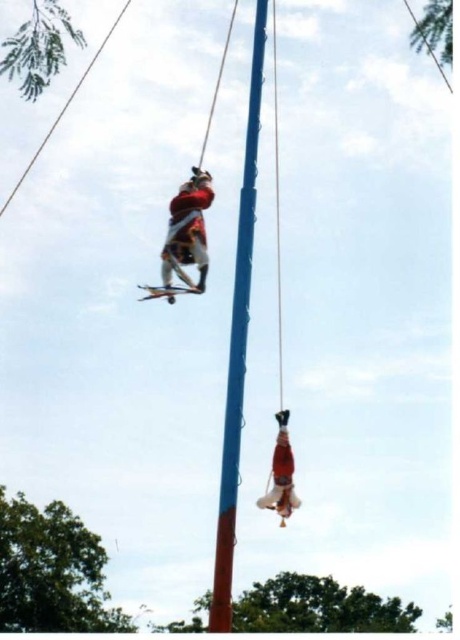
Question: From the image, what is the correct spatial relationship of blue painted wood pole at center in relation to red fabric person at lower center?

Choices:
 (A) left
 (B) right

Answer: (A)

Question: Which point is closer to the camera taking this photo?

Choices:
 (A) (272, 452)
 (B) (257, 120)

Answer: (A)

Question: Can you confirm if red fabric person at upper center is positioned to the right of red fabric person at lower center?

Choices:
 (A) no
 (B) yes

Answer: (A)

Question: Which object is the farthest from the blue painted wood pole at center?

Choices:
 (A) red fabric person at lower center
 (B) red fabric person at upper center

Answer: (A)

Question: Is red fabric person at upper center further to camera compared to red fabric person at lower center?

Choices:
 (A) yes
 (B) no

Answer: (A)

Question: Which of these objects is positioned farthest from the blue painted wood pole at center?

Choices:
 (A) red fabric person at lower center
 (B) red fabric person at upper center

Answer: (A)